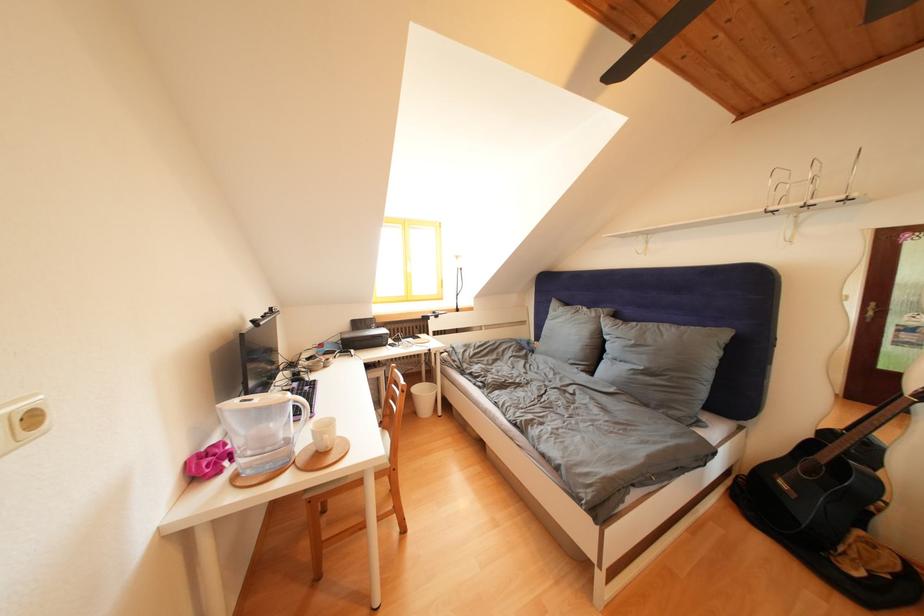
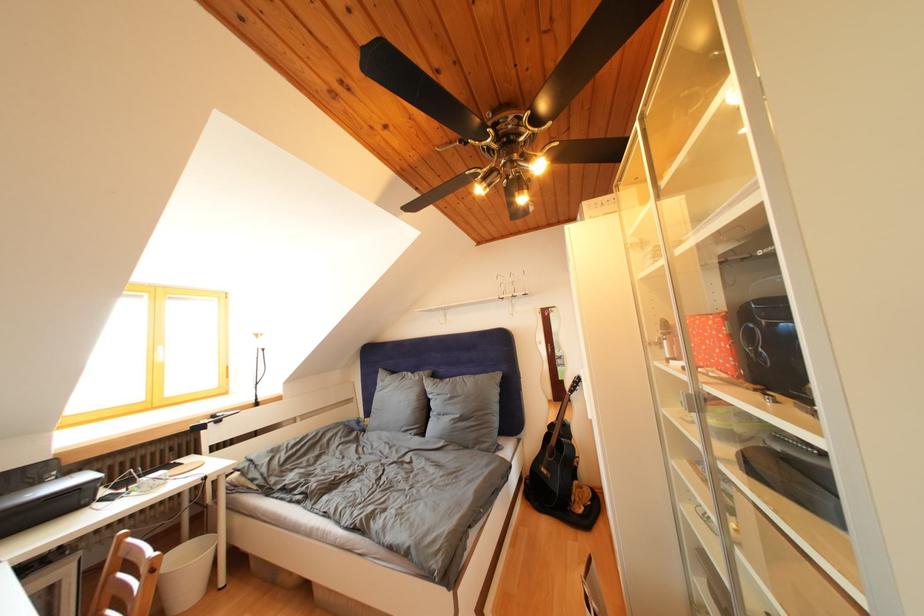
In the second image, find the point that corresponds to the point at 378,333 in the first image.

(44, 488)